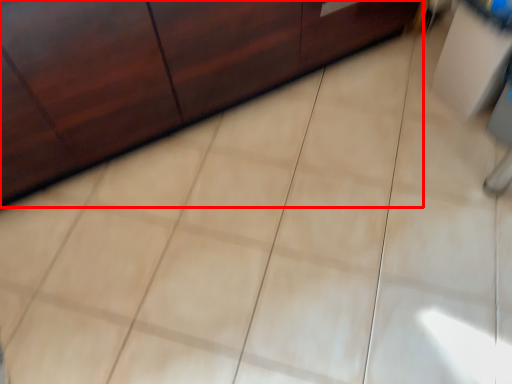
Question: Observing the image, what is the correct spatial positioning of furniture (annotated by the red box) in reference to vanity?

Choices:
 (A) left
 (B) right

Answer: (A)